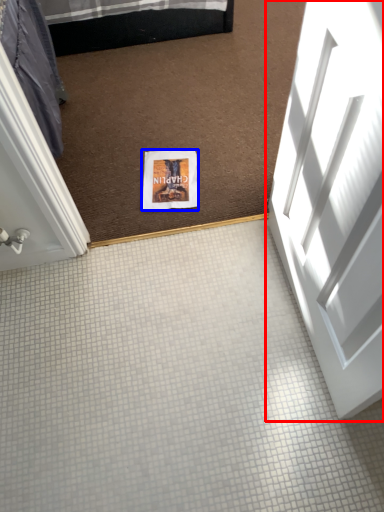
Question: Which of the following is the closest to the observer, door (highlighted by a red box) or flyer (highlighted by a blue box)?

Choices:
 (A) door
 (B) flyer

Answer: (A)